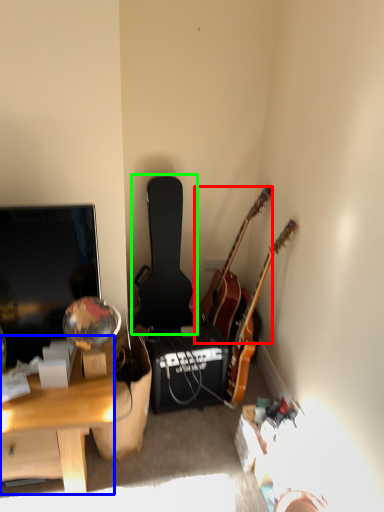
Question: Which object is positioned closest to guitar (highlighted by a red box)? Select from desk (highlighted by a blue box) and guitar (highlighted by a green box).

Choices:
 (A) desk
 (B) guitar

Answer: (B)